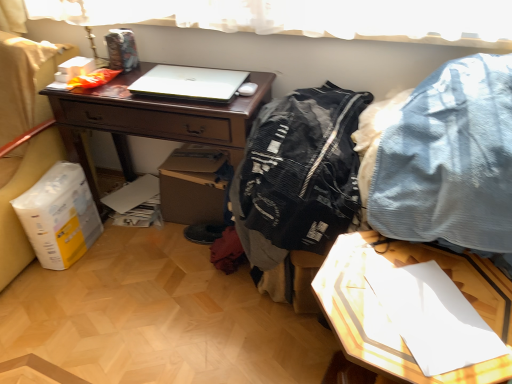
Question: Considering the positions of white glossy paper at lower right and denim fabric pants at upper right, acting as the 2th clothing starting from the left, in the image, is white glossy paper at lower right taller or shorter than denim fabric pants at upper right, acting as the 2th clothing starting from the left,?

Choices:
 (A) short
 (B) tall

Answer: (B)

Question: Which is correct: white glossy paper at lower right is inside denim fabric pants at upper right, acting as the 2th clothing starting from the left, or outside of it?

Choices:
 (A) outside
 (B) inside

Answer: (A)

Question: Based on their relative distances, which object is farther from the white matte laptop at center?

Choices:
 (A) denim fabric pants at upper right, acting as the 2th clothing starting from the left
 (B) white glossy paper at lower right
 (C) matte brown desk at center
 (D) black mesh jacket at center, the 1th clothing when ordered from left to right

Answer: (B)

Question: Which object is the farthest from the white matte laptop at center?

Choices:
 (A) white glossy paper at lower right
 (B) black mesh jacket at center, the 1th clothing when ordered from left to right
 (C) denim fabric pants at upper right, acting as the 2th clothing starting from the left
 (D) matte brown desk at center

Answer: (A)